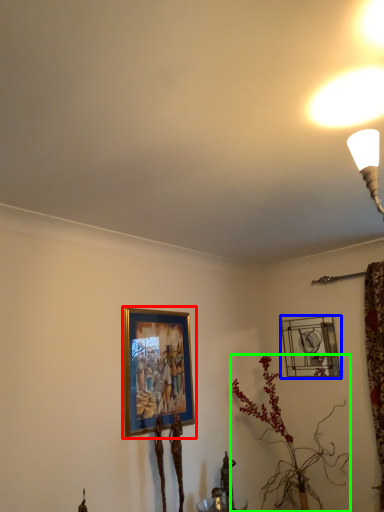
Question: Which object is the closest to the picture frame (highlighted by a red box)? Choose among these: picture frame (highlighted by a blue box) or houseplant (highlighted by a green box).

Choices:
 (A) picture frame
 (B) houseplant

Answer: (B)